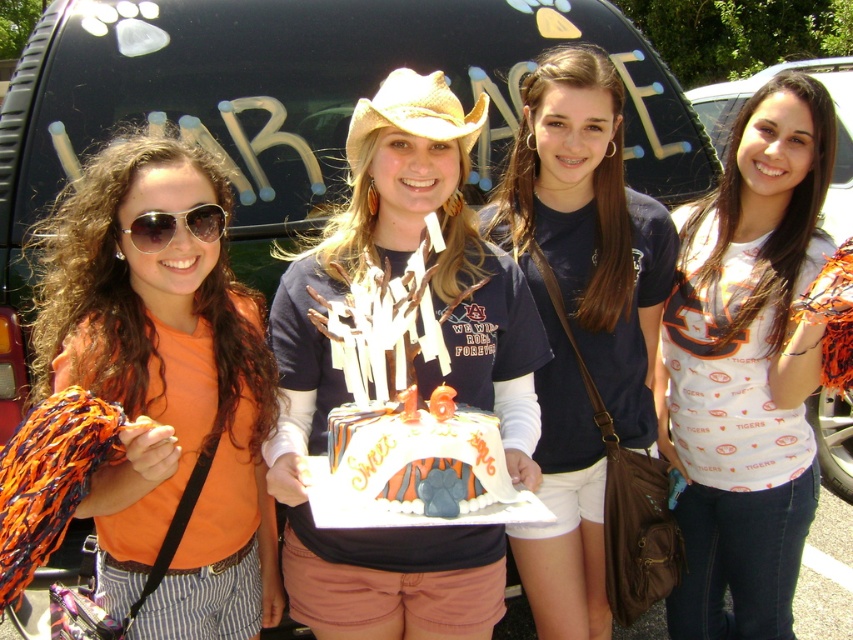
Is orange fabric pom-pom at left positioned at the back of white fondant cake at center?

Yes.

Does point (180, 417) come in front of point (392, 404)?

No, it is not.

At what (x,y) coordinates should I click in order to perform the action: click on orange fabric pom-pom at left. Please return your answer as a coordinate pair (x, y). Looking at the image, I should click on (165, 394).

Does point (752, 584) come farther from viewer compared to point (402, 77)?

Yes.

Is point (776, 509) less distant than point (425, 97)?

No.

At what (x,y) coordinates should I click in order to perform the action: click on white printed shirt at center. Please return your answer as a coordinate pair (x, y). The image size is (853, 640). Looking at the image, I should click on (747, 365).

Which is behind, point (131, 477) or point (779, 499)?

The point (779, 499) is more distant.

Locate an element on the screen. Image resolution: width=853 pixels, height=640 pixels. orange fabric pom-pom at left is located at coordinates (165, 394).

Find the location of a particular element. The image size is (853, 640). orange fabric pom-pom at left is located at coordinates (165, 394).